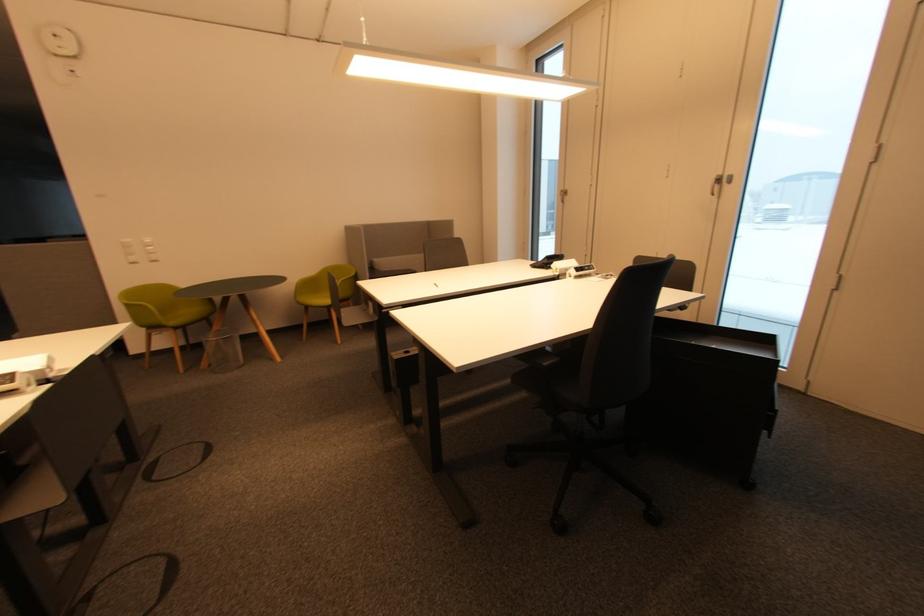
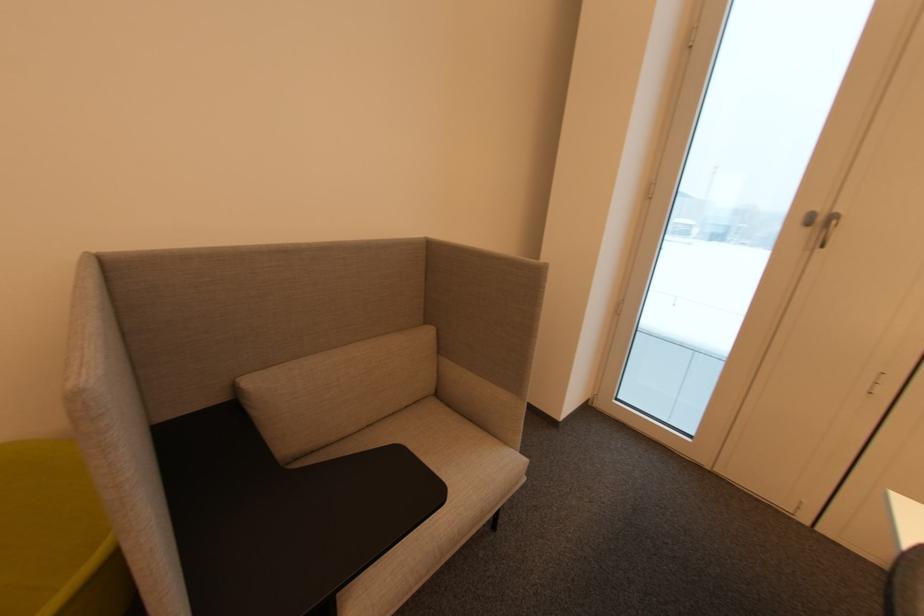
Question: In a continuous first-person perspective shot, in which direction is the camera moving?

Choices:
 (A) Left
 (B) Right
 (C) Forward
 (D) Backward

Answer: (C)